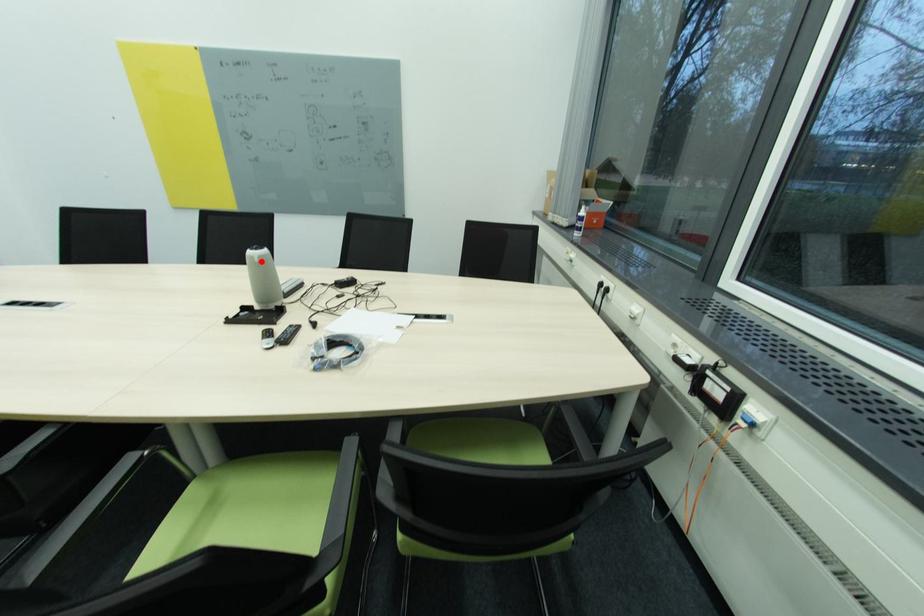
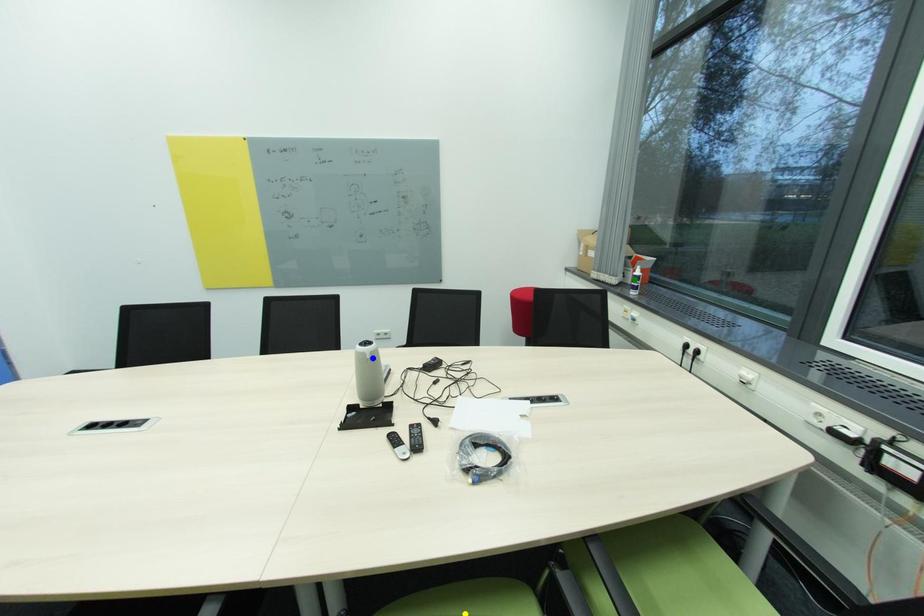
Question: I am providing you with two images of the same scene from different viewpoints. A red point is marked on the first image. You are given multiple points on the second image. Which point in image 2 is actually the same real-world point as the red point in image 1?

Choices:
 (A) yellow point
 (B) blue point
 (C) green point

Answer: (B)